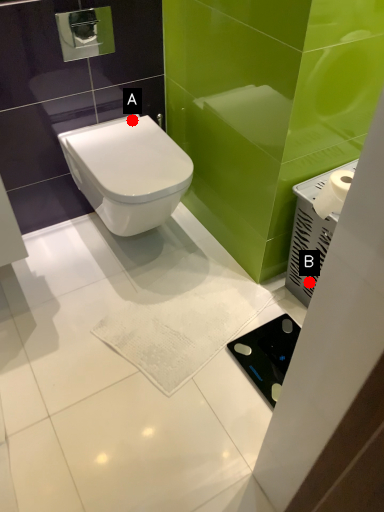
Question: Two points are circled on the image, labeled by A and B beside each circle. Which point is closer to the camera taking this photo?

Choices:
 (A) A is closer
 (B) B is closer

Answer: (B)